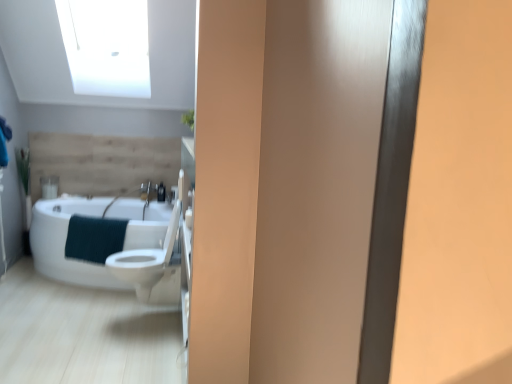
Question: Is white glossy sink at center not close to white glossy bathtub at left?

Choices:
 (A) yes
 (B) no

Answer: (B)

Question: Is white glossy sink at center positioned beyond the bounds of white glossy bathtub at left?

Choices:
 (A) no
 (B) yes

Answer: (A)

Question: Does white glossy sink at center have a greater width compared to white glossy bathtub at left?

Choices:
 (A) no
 (B) yes

Answer: (A)

Question: Is white glossy sink at center aimed at white glossy bathtub at left?

Choices:
 (A) no
 (B) yes

Answer: (B)

Question: Is white glossy sink at center thinner than white glossy bathtub at left?

Choices:
 (A) yes
 (B) no

Answer: (A)

Question: From the image's perspective, relative to white glossy toilet at center, is matte black soap dispenser at center above or below?

Choices:
 (A) below
 (B) above

Answer: (B)

Question: Considering the positions of matte black soap dispenser at center and white glossy toilet at center in the image, is matte black soap dispenser at center taller or shorter than white glossy toilet at center?

Choices:
 (A) short
 (B) tall

Answer: (A)

Question: In terms of size, does matte black soap dispenser at center appear bigger or smaller than white glossy toilet at center?

Choices:
 (A) small
 (B) big

Answer: (A)

Question: Visually, is matte black soap dispenser at center positioned to the left or to the right of white glossy toilet at center?

Choices:
 (A) right
 (B) left

Answer: (B)

Question: From a real-world perspective, is matte black soap dispenser at center positioned above or below teal textured towel at lower left?

Choices:
 (A) below
 (B) above

Answer: (B)

Question: Considering the relative positions of matte black soap dispenser at center and teal textured towel at lower left in the image provided, is matte black soap dispenser at center to the left or to the right of teal textured towel at lower left?

Choices:
 (A) left
 (B) right

Answer: (B)

Question: From the image's perspective, relative to teal textured towel at lower left, is matte black soap dispenser at center above or below?

Choices:
 (A) below
 (B) above

Answer: (B)

Question: Is point (157, 188) closer or farther from the camera than point (94, 254)?

Choices:
 (A) closer
 (B) farther

Answer: (B)

Question: From a real-world perspective, is white glossy sink at center physically located above or below teal textured towel at lower left?

Choices:
 (A) above
 (B) below

Answer: (A)

Question: Is white glossy sink at center in front of or behind teal textured towel at lower left in the image?

Choices:
 (A) front
 (B) behind

Answer: (B)